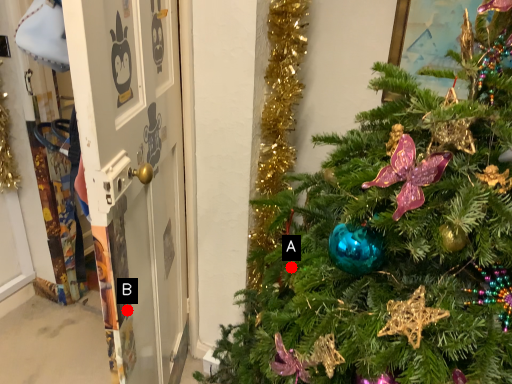
Question: Two points are circled on the image, labeled by A and B beside each circle. Among these points, which one is farthest from the camera?

Choices:
 (A) A is further
 (B) B is further

Answer: (B)